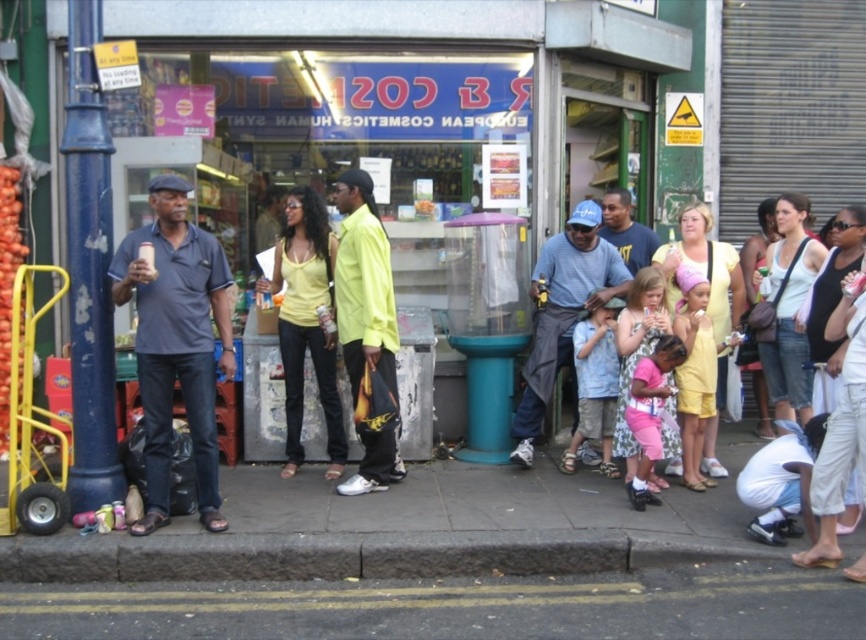
Does dark blue shirt at left lie in front of matte blue shirt at center?

Yes, dark blue shirt at left is closer to the viewer.

Can you confirm if dark blue shirt at left is smaller than matte blue shirt at center?

Actually, dark blue shirt at left might be larger than matte blue shirt at center.

Does point (205, 435) come closer to viewer compared to point (632, 244)?

Yes.

The width and height of the screenshot is (866, 640). What are the coordinates of `dark blue shirt at left` in the screenshot? It's located at (176, 342).

Does dark blue shirt at left come in front of matte yellow tank top at center?

Yes.

Does point (197, 330) lie in front of point (293, 419)?

Yes, it is.

Is point (153, 515) farther from camera compared to point (285, 198)?

No, (153, 515) is closer to viewer.

Where is `dark blue shirt at left`? dark blue shirt at left is located at coordinates (176, 342).

This screenshot has height=640, width=866. In order to click on black asphalt at lower center in this screenshot , I will do `click(453, 609)`.

Between point (195, 602) and point (656, 241), which one is positioned in front?

Point (195, 602)

This screenshot has width=866, height=640. What do you see at coordinates (453, 609) in the screenshot? I see `black asphalt at lower center` at bounding box center [453, 609].

Find the location of `black asphalt at lower center`. black asphalt at lower center is located at coordinates (453, 609).